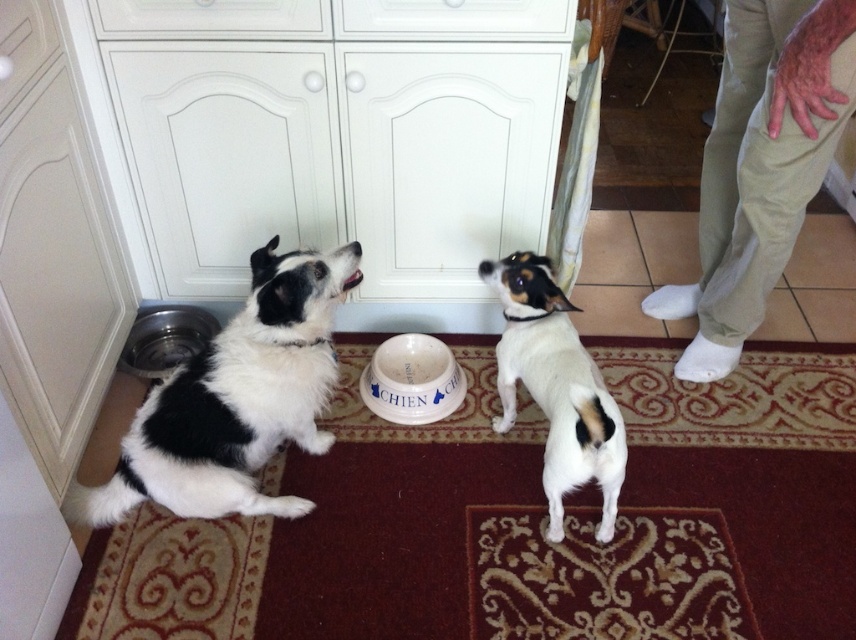
You are a pet owner who wants to ensure your white fur dog at center has enough space to drink from the white ceramic bowl at center. Based on their sizes, is the bowl appropriately sized for the dog?

The white fur dog at center is larger than the white ceramic bowl at center, so the bowl may be too small for the dog to drink comfortably. Consider getting a larger bowl.

You are a dog owner who wants to place a new decorative item on the surface between the white glossy cabinet at upper center and the metallic silver bowl at lower left. Based on their positions, which side of the cabinet should you place the item so it stays aligned with the existing layout?

The white glossy cabinet at upper center is to the right of the metallic silver bowl at lower left, so placing the decorative item to the right side of the cabinet would maintain alignment with the existing layout.

You are a pet owner who wants to place a new decorative item on the white glossy cabinet at upper center. However, you need to ensure that the item won not block the view of the metallic silver bowl at lower left from where you are standing. Can you confirm if the cabinet is above the bowl?

The white glossy cabinet at upper center is positioned over the metallic silver bowl at lower left, so placing the item on the cabinet might block the view of the bowl depending on the item size and placement. To ensure visibility, choose a smaller item or place it towards the edge of the cabinet.